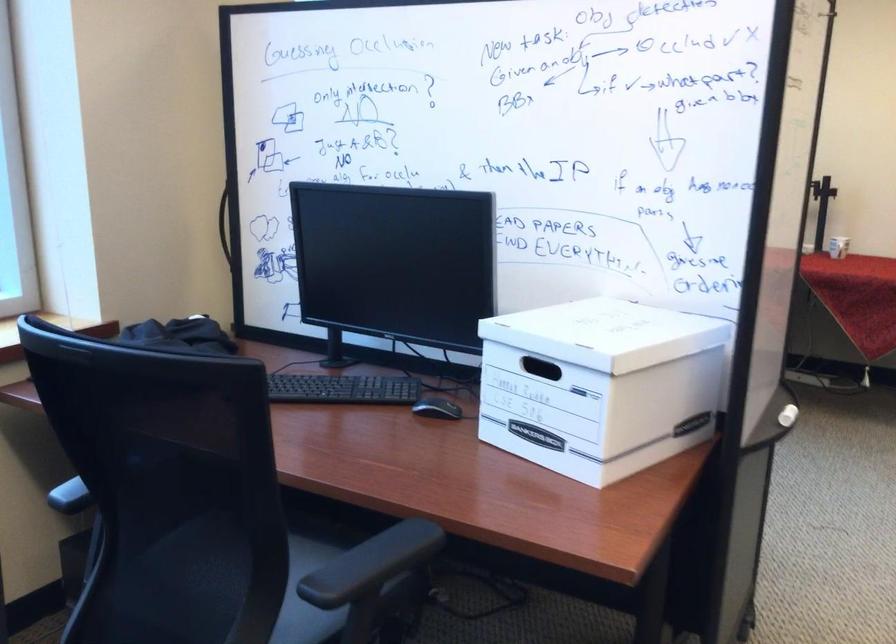
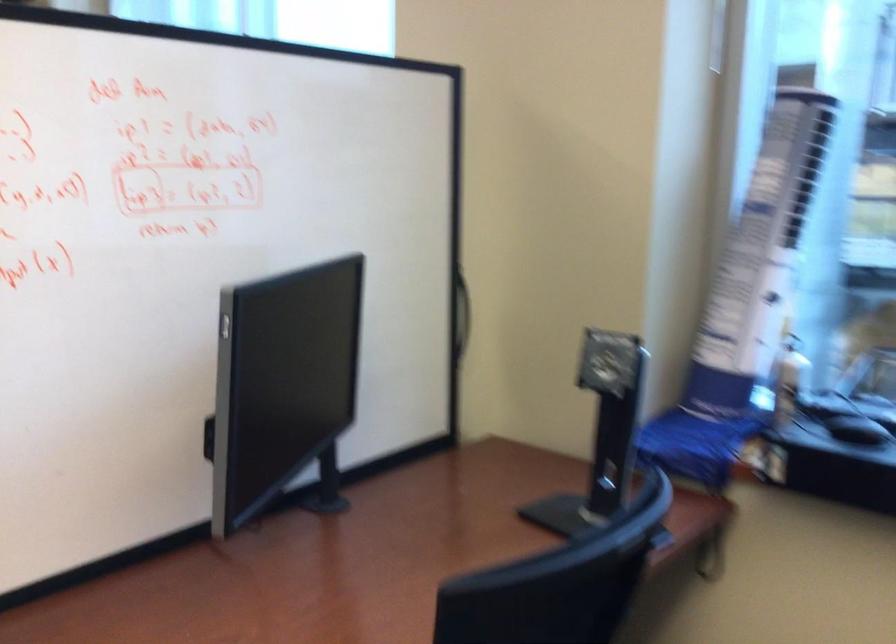
Locate, in the second image, the point that corresponds to (x=186, y=238) in the first image.

(461, 313)